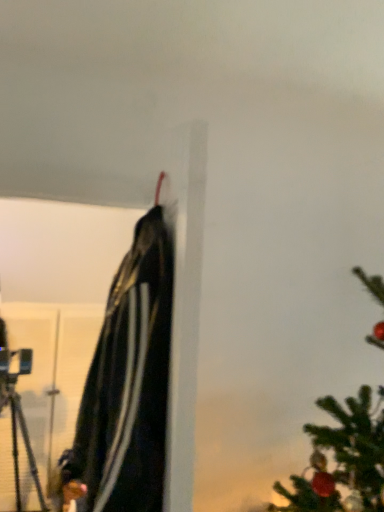
Image resolution: width=384 pixels, height=512 pixels. What do you see at coordinates (128, 383) in the screenshot?
I see `black matte jacket at upper center` at bounding box center [128, 383].

The image size is (384, 512). What are the coordinates of `black matte jacket at upper center` in the screenshot? It's located at (128, 383).

What is the approximate width of black matte jacket at upper center?

The width of black matte jacket at upper center is 9.47 inches.

What do you see at coordinates (23, 440) in the screenshot?
I see `black matte tripod at left` at bounding box center [23, 440].

This screenshot has height=512, width=384. Identify the location of black matte tripod at left. (23, 440).

Locate an element on the screen. black matte jacket at upper center is located at coordinates (128, 383).

Which is more to the right, black matte tripod at left or black matte jacket at upper center?

black matte jacket at upper center.

Which object is further away from the camera, black matte tripod at left or black matte jacket at upper center?

Positioned behind is black matte tripod at left.

Is point (12, 444) closer to viewer compared to point (80, 509)?

No.

From the picture: From the image's perspective, which object appears higher, black matte tripod at left or black matte jacket at upper center?

From the image's view, black matte jacket at upper center is above.

From a real-world perspective, who is located higher, black matte tripod at left or black matte jacket at upper center?

black matte jacket at upper center, from a real-world perspective.

Does black matte tripod at left have a greater width compared to black matte jacket at upper center?

Correct, the width of black matte tripod at left exceeds that of black matte jacket at upper center.

Is black matte tripod at left shorter than black matte jacket at upper center?

No, black matte tripod at left is not shorter than black matte jacket at upper center.

Based on their sizes in the image, would you say black matte tripod at left is bigger or smaller than black matte jacket at upper center?

Clearly, black matte tripod at left is larger in size than black matte jacket at upper center.

Is black matte tripod at left surrounding black matte jacket at upper center?

Definitely not — black matte jacket at upper center is not inside black matte tripod at left.

Is black matte tripod at left not near black matte jacket at upper center?

black matte tripod at left is far away from black matte jacket at upper center.

Could you tell me if black matte tripod at left is turned towards black matte jacket at upper center?

Yes, black matte tripod at left faces towards black matte jacket at upper center.

Can you tell me how much black matte tripod at left and black matte jacket at upper center differ in facing direction?

93.7 degrees.

Locate an element on the screen. The width and height of the screenshot is (384, 512). tripod behind the black matte jacket at upper center is located at coordinates (23, 440).

Considering the positions of objects black matte jacket at upper center and black matte tripod at left in the image provided, who is more to the left, black matte jacket at upper center or black matte tripod at left?

Positioned to the left is black matte tripod at left.

Which object is more forward, black matte jacket at upper center or black matte tripod at left?

Positioned in front is black matte jacket at upper center.

Does point (93, 490) lie behind point (7, 377)?

No, (93, 490) is in front of (7, 377).

From the image's perspective, which object appears higher, black matte jacket at upper center or black matte tripod at left?

black matte jacket at upper center appears higher in the image.

From a real-world perspective, is black matte jacket at upper center positioned under black matte tripod at left based on gravity?

Incorrect, from a real-world perspective, black matte jacket at upper center is higher than black matte tripod at left.

Is black matte jacket at upper center wider than black matte tripod at left?

No, black matte jacket at upper center is not wider than black matte tripod at left.

Based on the photo, who is taller, black matte jacket at upper center or black matte tripod at left?

With more height is black matte tripod at left.

Can you confirm if black matte jacket at upper center is bigger than black matte tripod at left?

No, black matte jacket at upper center is not bigger than black matte tripod at left.

Is black matte jacket at upper center spatially inside black matte tripod at left, or outside of it?

black matte jacket at upper center lies outside black matte tripod at left.

Would you say black matte jacket at upper center is a long distance from black matte tripod at left?

That's right, there is a large distance between black matte jacket at upper center and black matte tripod at left.

Is black matte jacket at upper center oriented away from black matte tripod at left?

That's not correct — black matte jacket at upper center is not looking away from black matte tripod at left.

How distant is black matte jacket at upper center from black matte tripod at left?

black matte jacket at upper center and black matte tripod at left are 8.13 feet apart.

I want to click on cloak above the black matte tripod at left (from a real-world perspective), so click(128, 383).

In order to click on tripod on the left of black matte jacket at upper center in this screenshot , I will do `click(23, 440)`.

You are a GUI agent. You are given a task and a screenshot of the screen. Output one action in this format:
    pyautogui.click(x=<x>, y=<y>)
    Task: Click on the tripod that appears behind the black matte jacket at upper center
    The image size is (384, 512).
    Given the screenshot: What is the action you would take?
    pyautogui.click(x=23, y=440)